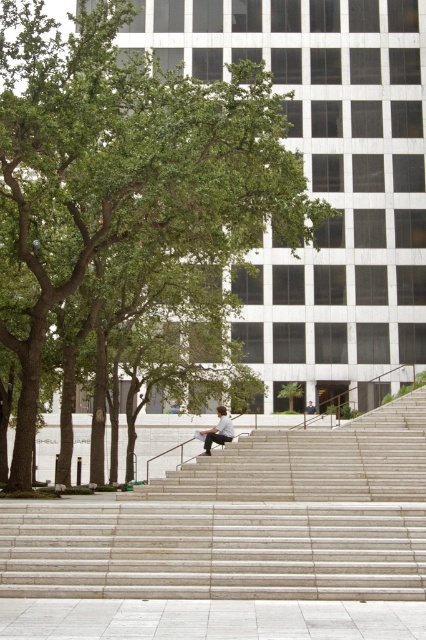
Does green leafy tree at center appear under light brown wooden skateboard at center?

Incorrect, green leafy tree at center is not positioned below light brown wooden skateboard at center.

Does green leafy tree at center appear on the left side of light brown wooden skateboard at center?

Indeed, green leafy tree at center is positioned on the left side of light brown wooden skateboard at center.

Is point (78, 58) positioned before point (219, 428)?

Yes, point (78, 58) is in front of point (219, 428).

The width and height of the screenshot is (426, 640). Identify the location of green leafy tree at center. (123, 172).

Who is positioned more to the left, smooth concrete stairs at center or light brown wooden skateboard at center?

Positioned to the left is light brown wooden skateboard at center.

Which is in front, point (327, 497) or point (209, 442)?

Point (327, 497) is more forward.

Is point (396, 406) positioned after point (229, 438)?

Yes, it is behind point (229, 438).

Find the location of a particular element. smooth concrete stairs at center is located at coordinates (244, 522).

Does green leafy tree at center lie behind smooth concrete stairs at center?

Yes, it is behind smooth concrete stairs at center.

Who is more distant from viewer, (58,237) or (423,387)?

The point (423,387) is behind.

The width and height of the screenshot is (426, 640). Find the location of `green leafy tree at center`. green leafy tree at center is located at coordinates (123, 172).